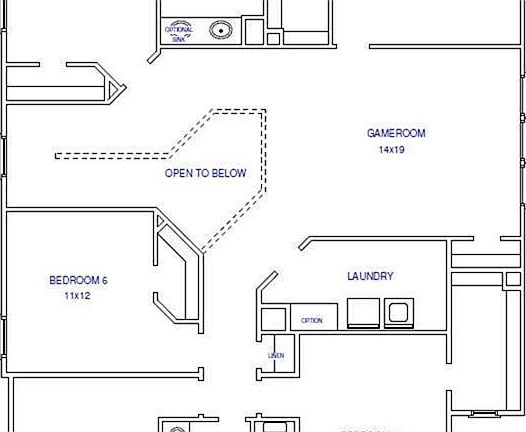
This screenshot has width=526, height=432. Identify the location of room. (207, 428).